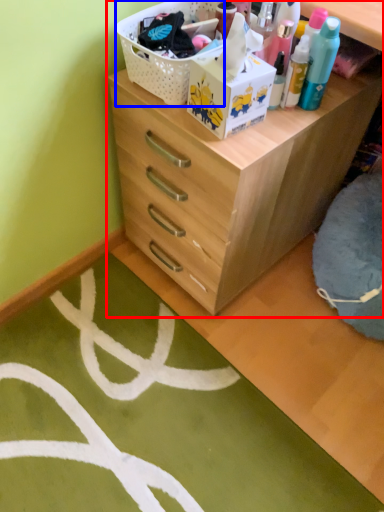
Question: Which of the following is the closest to the observer, chest of drawers (highlighted by a red box) or basket (highlighted by a blue box)?

Choices:
 (A) chest of drawers
 (B) basket

Answer: (A)